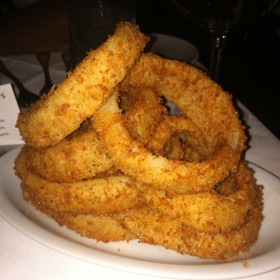
Find the location of a particular element. chair is located at coordinates coord(188,48).